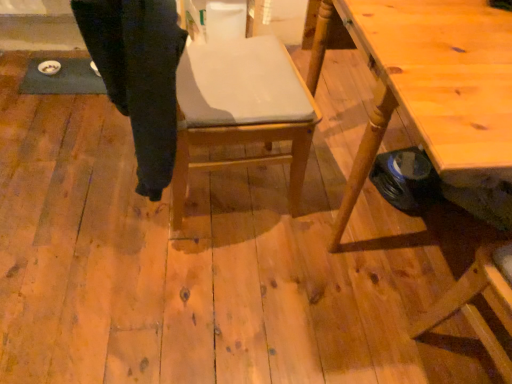
Locate an element on the screen. This screenshot has width=512, height=384. vacant area that lies between wooden chair at center and wooden table at right is located at coordinates (262, 258).